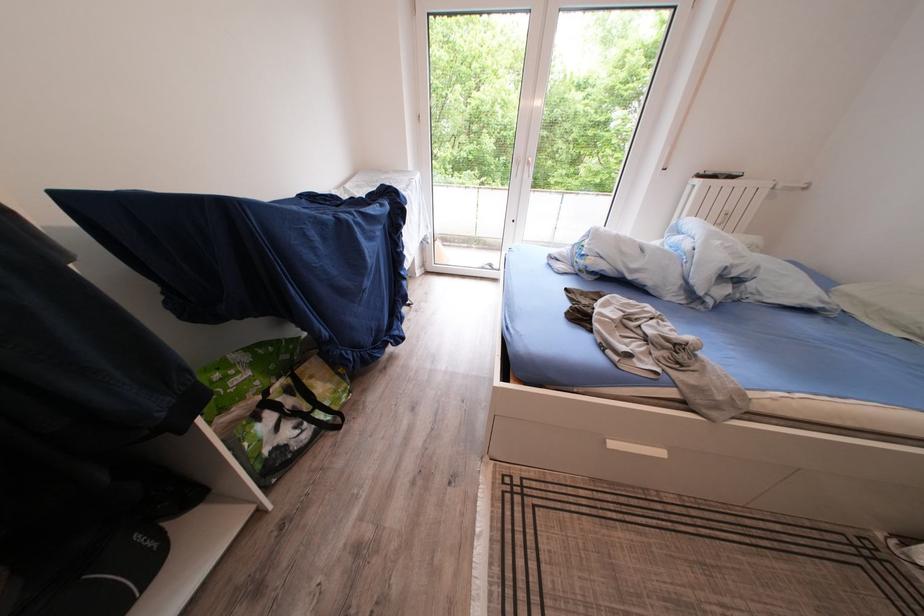
Locate an element on the screen. This screenshot has width=924, height=616. radiator thermostat knob is located at coordinates (727, 214).